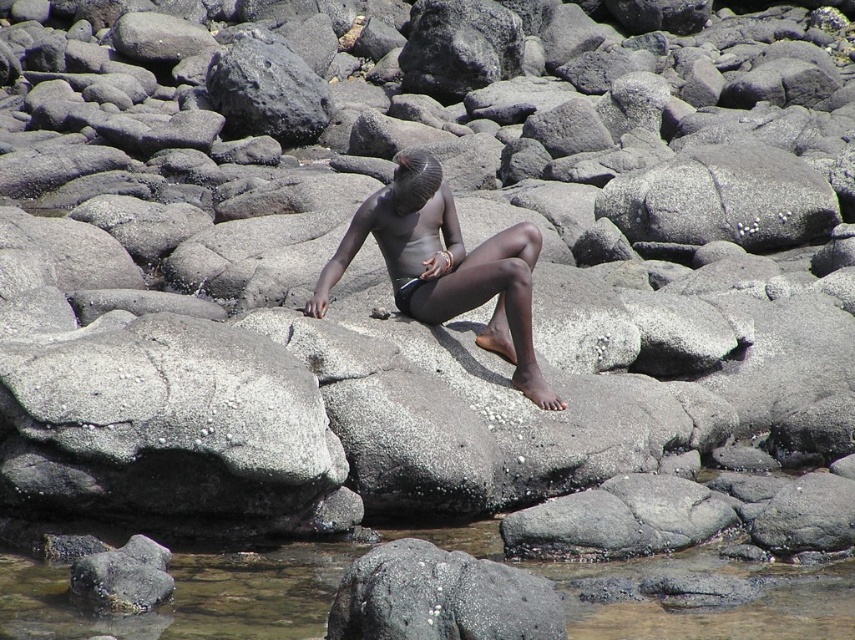
You are a photographer planning to capture the scene from the shore. You notice the clear water at river bottom left and the matte black skin at center. Which object would you need to adjust your camera focus on first if you want to ensure both are in focus, considering their sizes?

The clear water at river bottom left is smaller in size compared to the matte black skin at center, so you should focus on the matte black skin at center first to ensure both are in focus.